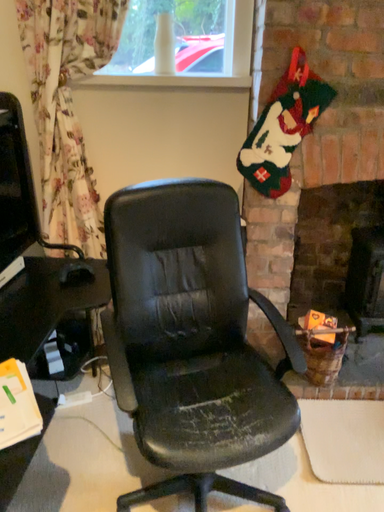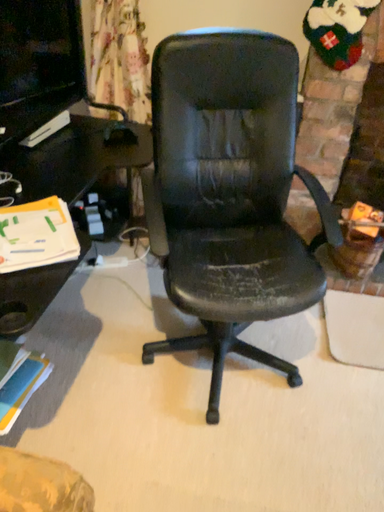
Question: Which way did the camera rotate in the video?

Choices:
 (A) rotated downward
 (B) rotated upward

Answer: (A)